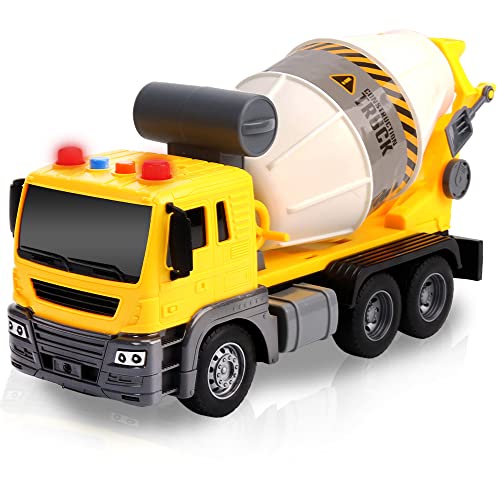
Where is `windows`? The width and height of the screenshot is (500, 500). windows is located at coordinates (191, 238), (232, 229), (110, 243).